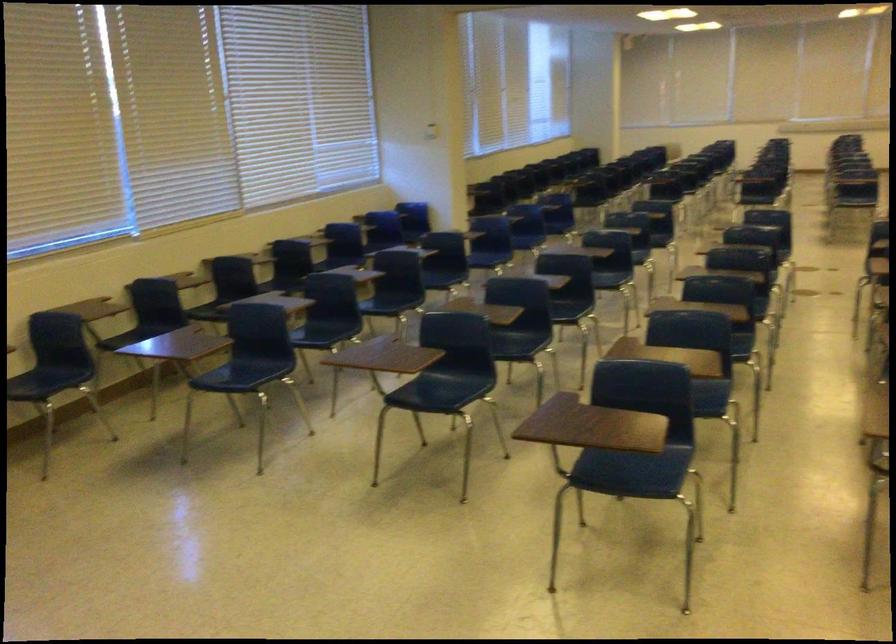
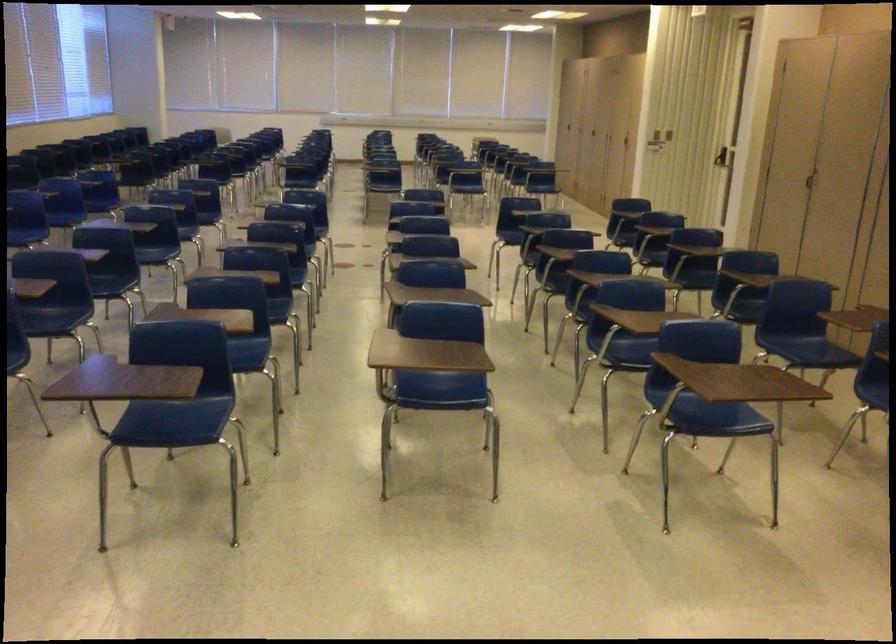
Question: The camera is either moving clockwise (left) or counter-clockwise (right) around the object. The first image is from the beginning of the video and the second image is from the end. Is the camera moving left or right when shooting the video?

Choices:
 (A) Left
 (B) Right

Answer: (A)